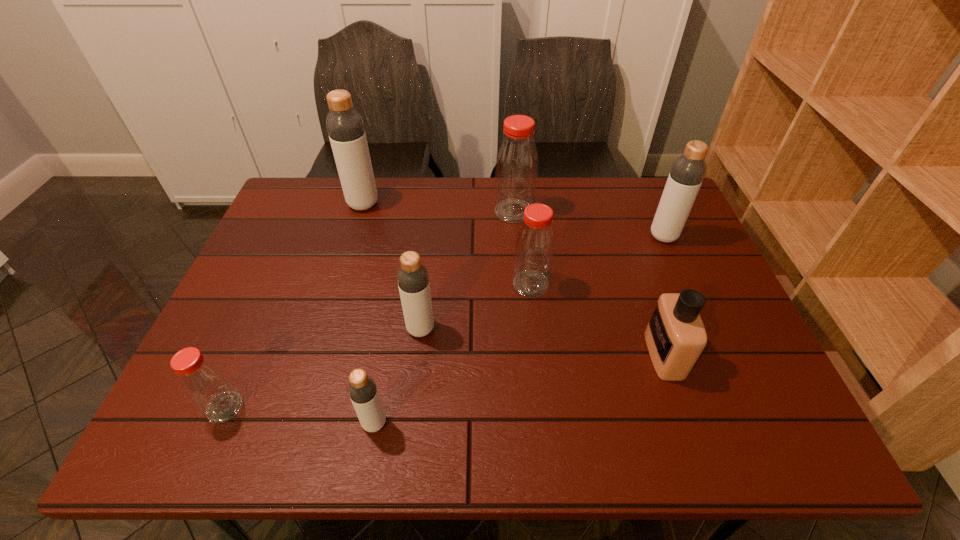
Find the location of a particular element. This screenshot has width=960, height=540. blank region between the third nearest gray bottle and the third gray bottle from right to left is located at coordinates click(x=519, y=329).

Find the location of a particular element. This screenshot has height=540, width=960. empty space between the leftmost gray bottle and the second smallest red bottle is located at coordinates click(446, 244).

Locate an element on the screen. The image size is (960, 540). object that is the fifth closest to the rightmost bottle is located at coordinates (345, 127).

Select which object appears as the sixth closest to the biggest gray bottle. Please provide its 2D coordinates. Your answer should be formatted as a tuple, i.e. [(x, y)], where the tuple contains the x and y coordinates of a point satisfying the conditions above.

[(685, 178)]

I want to click on bottle that is the sixth closest one to the fifth nearest bottle, so click(x=203, y=381).

Find the location of a particular element. This screenshot has height=540, width=960. the fifth closest bottle to the tallest bottle is located at coordinates (362, 389).

Locate which gray bottle is the fourth closest to the farthest red bottle. Please provide its 2D coordinates. Your answer should be formatted as a tuple, i.e. [(x, y)], where the tuple contains the x and y coordinates of a point satisfying the conditions above.

[(362, 389)]

Locate which gray bottle ranks in proximity to the leftmost bottle. Please provide its 2D coordinates. Your answer should be formatted as a tuple, i.e. [(x, y)], where the tuple contains the x and y coordinates of a point satisfying the conditions above.

[(362, 389)]

Identify which red bottle is the second nearest to the third object from left to right. Please provide its 2D coordinates. Your answer should be formatted as a tuple, i.e. [(x, y)], where the tuple contains the x and y coordinates of a point satisfying the conditions above.

[(534, 249)]

This screenshot has height=540, width=960. What are the coordinates of `red bottle that is the second nearest to the biggest red bottle` in the screenshot? It's located at (203, 381).